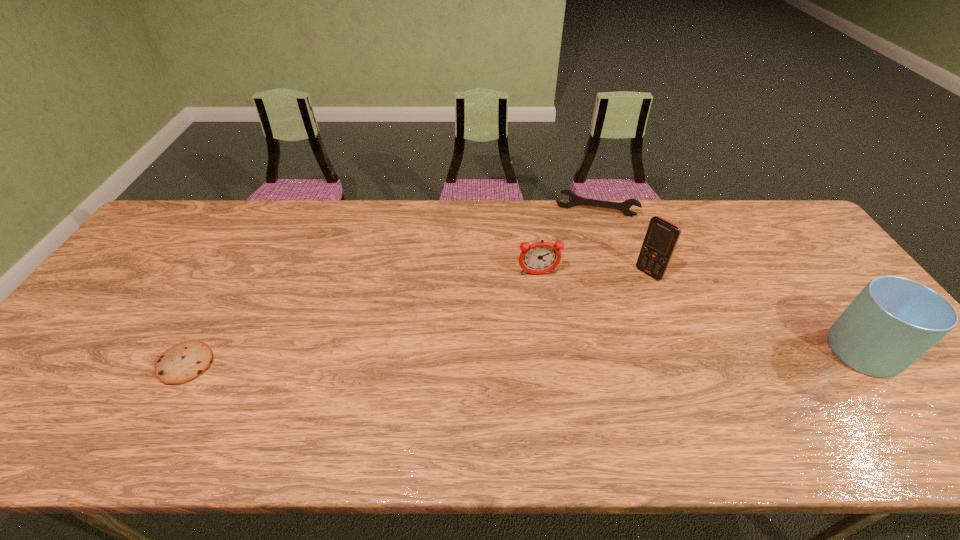
Find the location of a particular element. The height and width of the screenshot is (540, 960). the leftmost object is located at coordinates (184, 362).

Locate an element on the screen. Image resolution: width=960 pixels, height=540 pixels. cookie is located at coordinates (184, 362).

Identify the location of mug. Image resolution: width=960 pixels, height=540 pixels. (893, 321).

Find the location of `the third tallest object`. the third tallest object is located at coordinates (539, 258).

You are a GUI agent. You are given a task and a screenshot of the screen. Output one action in this format:
    pyautogui.click(x=<x>, y=<y>)
    Task: Click on the second object from left to right
    This screenshot has height=540, width=960.
    Given the screenshot: What is the action you would take?
    pyautogui.click(x=539, y=258)

The width and height of the screenshot is (960, 540). In order to click on the farthest object in this screenshot , I will do `click(575, 200)`.

The width and height of the screenshot is (960, 540). Find the location of `the second shortest object`. the second shortest object is located at coordinates (575, 200).

The width and height of the screenshot is (960, 540). Find the location of `cellular telephone`. cellular telephone is located at coordinates (661, 238).

You are a GUI agent. You are given a task and a screenshot of the screen. Output one action in this format:
    pyautogui.click(x=<x>, y=<y>)
    Task: Click on the vacant space situated 0.250m on the back of the cookie
    This screenshot has width=960, height=540.
    Given the screenshot: What is the action you would take?
    pyautogui.click(x=236, y=274)

The image size is (960, 540). What are the coordinates of `free space located 0.380m on the left of the mug` in the screenshot? It's located at (676, 352).